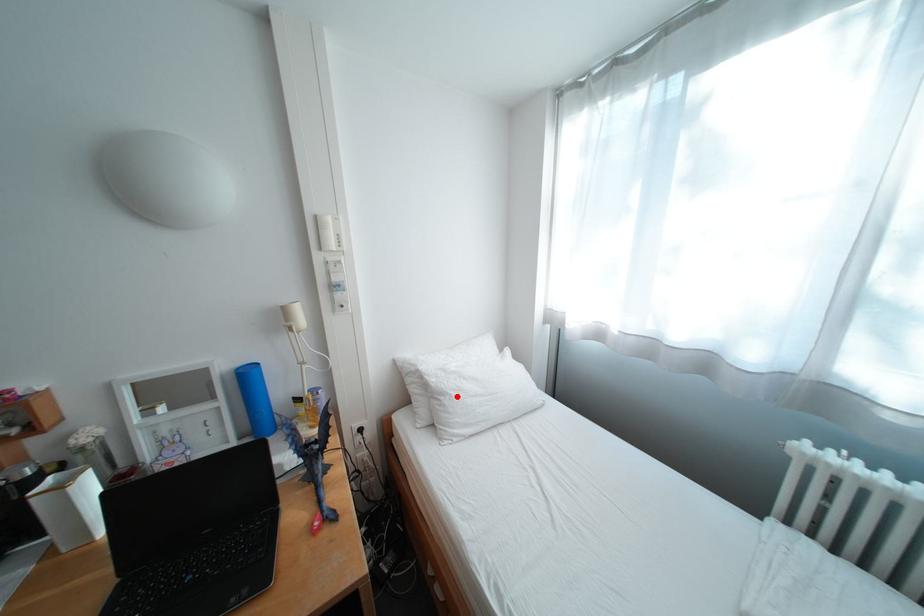
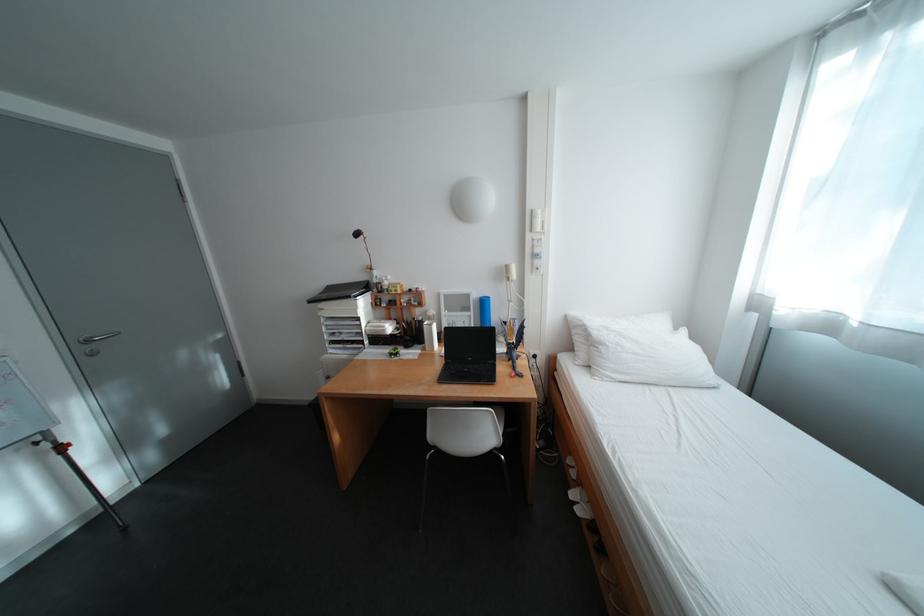
Question: A red point is marked in image1. In image2, is the corresponding 3D point closer to the camera or farther? Reply with the corresponding letter.

Choices:
 (A) The corresponding 3D point is closer.
 (B) The corresponding 3D point is farther.

Answer: (A)